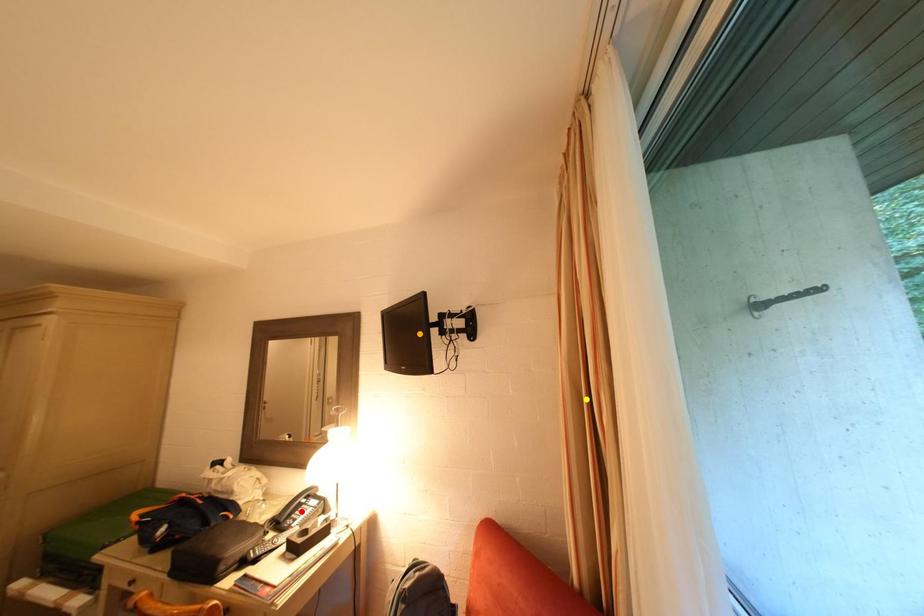
Order these from nearest to farthest:
orange point
yellow point
red point

1. yellow point
2. orange point
3. red point